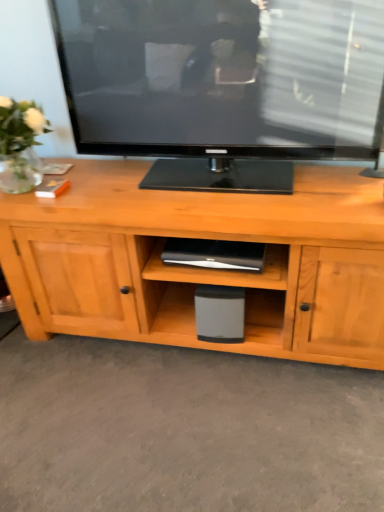
The width and height of the screenshot is (384, 512). What do you see at coordinates (220, 313) in the screenshot? I see `gray matte speaker at center` at bounding box center [220, 313].

I want to click on gray matte speaker at center, so click(220, 313).

What do you see at coordinates (20, 144) in the screenshot? Image resolution: width=384 pixels, height=512 pixels. I see `clear glass vase at left` at bounding box center [20, 144].

Find the location of a particular element. This screenshot has width=384, height=512. clear glass vase at left is located at coordinates (20, 144).

Identify the location of gray matte speaker at center. This screenshot has height=512, width=384. (220, 313).

Between gray matte speaker at center and clear glass vase at left, which one appears on the right side from the viewer's perspective?

gray matte speaker at center.

Between gray matte speaker at center and clear glass vase at left, which one is positioned behind?

gray matte speaker at center is more distant.

Which point is more forward, (231, 302) or (31, 141)?

The point (31, 141) is closer.

From the image's perspective, is gray matte speaker at center located beneath clear glass vase at left?

Correct, gray matte speaker at center appears lower than clear glass vase at left in the image.

From a real-world perspective, is gray matte speaker at center physically below clear glass vase at left?

Correct, in the physical world, gray matte speaker at center is lower than clear glass vase at left.

Between gray matte speaker at center and clear glass vase at left, which one has larger width?

Wider between the two is clear glass vase at left.

Looking at this image, who is shorter, gray matte speaker at center or clear glass vase at left?

Standing shorter between the two is gray matte speaker at center.

Can you confirm if gray matte speaker at center is bigger than clear glass vase at left?

No.

Is clear glass vase at left completely or partially inside gray matte speaker at center?

Definitely not — clear glass vase at left is not inside gray matte speaker at center.

Is gray matte speaker at center not close to clear glass vase at left?

They are positioned close to each other.

Is gray matte speaker at center turned away from clear glass vase at left?

No, clear glass vase at left is not at the back of gray matte speaker at center.

How many degrees apart are the facing directions of gray matte speaker at center and clear glass vase at left?

0.000144 degrees.

How much distance is there between gray matte speaker at center and clear glass vase at left?

gray matte speaker at center is 78.58 centimeters from clear glass vase at left.

In order to click on plant on the left of gray matte speaker at center in this screenshot , I will do `click(20, 144)`.

Is clear glass vase at left at the right side of gray matte speaker at center?

In fact, clear glass vase at left is to the left of gray matte speaker at center.

Considering the positions of objects clear glass vase at left and gray matte speaker at center in the image provided, who is behind, clear glass vase at left or gray matte speaker at center?

gray matte speaker at center is more distant.

Which point is more distant from viewer, [14,183] or [206,321]?

The point [206,321] is more distant.

From the image's perspective, is clear glass vase at left on top of gray matte speaker at center?

Yes, from the image's perspective, clear glass vase at left is on top of gray matte speaker at center.

From a real-world perspective, which is physically above, clear glass vase at left or gray matte speaker at center?

clear glass vase at left.

In terms of width, does clear glass vase at left look wider or thinner when compared to gray matte speaker at center?

In the image, clear glass vase at left appears to be wider than gray matte speaker at center.

Which of these two, clear glass vase at left or gray matte speaker at center, stands shorter?

gray matte speaker at center.

Can you confirm if clear glass vase at left is smaller than gray matte speaker at center?

Actually, clear glass vase at left might be larger than gray matte speaker at center.

Which is correct: clear glass vase at left is inside gray matte speaker at center, or outside of it?

clear glass vase at left is spatially situated outside gray matte speaker at center.

Are clear glass vase at left and gray matte speaker at center far apart?

No, clear glass vase at left is in close proximity to gray matte speaker at center.

Looking at this image, is clear glass vase at left facing towards gray matte speaker at center?

No, clear glass vase at left is not oriented towards gray matte speaker at center.

Can you tell me how much clear glass vase at left and gray matte speaker at center differ in facing direction?

0.000144 degrees.

Locate an element on the screen. This screenshot has width=384, height=512. plant that appears in front of the gray matte speaker at center is located at coordinates pyautogui.click(x=20, y=144).

Where is `plant in front of the gray matte speaker at center`? The image size is (384, 512). plant in front of the gray matte speaker at center is located at coordinates (20, 144).

At what (x,y) coordinates should I click in order to perform the action: click on speaker that is below the clear glass vase at left (from the image's perspective). Please return your answer as a coordinate pair (x, y). Looking at the image, I should click on (220, 313).